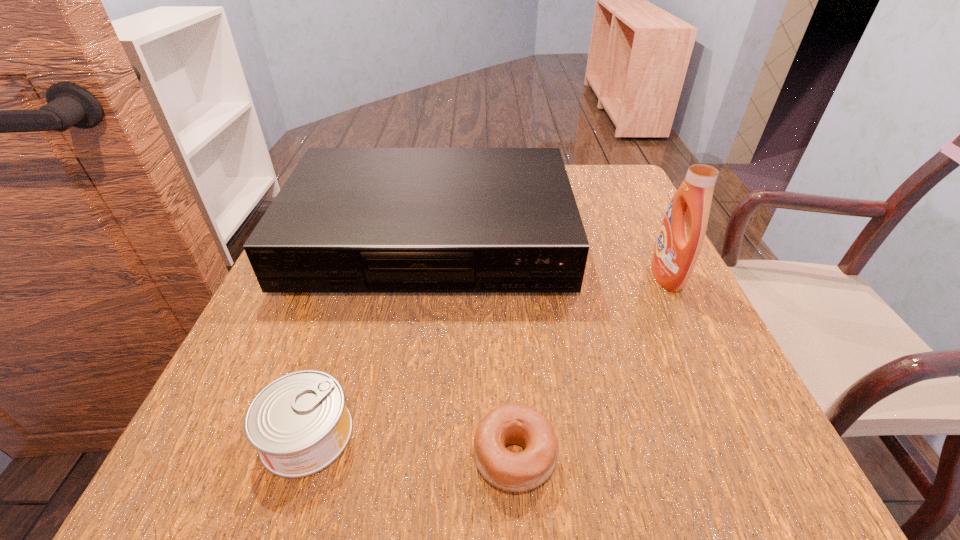
At what (x,y) coordinates should I click in order to perform the action: click on vacant space at the left edge of the desktop. Please return your answer as a coordinate pair (x, y). Looking at the image, I should click on (244, 387).

Locate an element on the screen. This screenshot has width=960, height=540. free space at the right edge of the desktop is located at coordinates (608, 238).

Where is `vacant region at the far right corner of the desktop`? The height and width of the screenshot is (540, 960). vacant region at the far right corner of the desktop is located at coordinates (615, 179).

Identify the location of vacant space at the near right corner of the desktop. (670, 465).

The width and height of the screenshot is (960, 540). In order to click on free space that is in between the second shortest object and the detergent in this screenshot , I will do `click(487, 355)`.

At what (x,y) coordinates should I click in order to perform the action: click on vacant space in between the bagel and the third tallest object. Please return your answer as a coordinate pair (x, y). Looking at the image, I should click on (412, 445).

Identify the location of free space between the shortest object and the rightmost object. (591, 366).

At what (x,y) coordinates should I click in order to perform the action: click on empty space between the third tallest object and the rightmost object. Please return your answer as a coordinate pair (x, y). Looking at the image, I should click on (487, 355).

You are a GUI agent. You are given a task and a screenshot of the screen. Output one action in this format:
    pyautogui.click(x=<x>, y=<y>)
    Task: Click on the vacant space that is in between the third tallest object and the shortest object
    Image resolution: width=960 pixels, height=540 pixels.
    Given the screenshot: What is the action you would take?
    412,445

The height and width of the screenshot is (540, 960). Identify the location of free point between the CD player and the can. (369, 336).